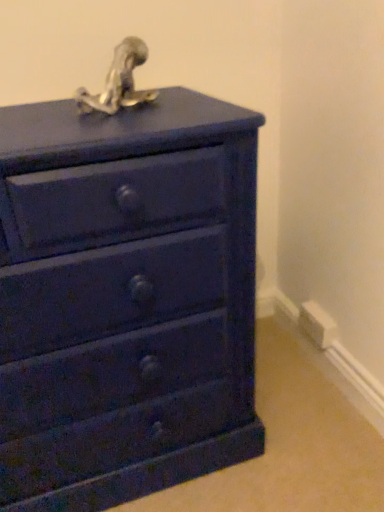
Question: In the image, is white plastic electric outlet at lower right on the left side or the right side of matte blue chest of drawers at center?

Choices:
 (A) right
 (B) left

Answer: (A)

Question: Is white plastic electric outlet at lower right situated inside matte blue chest of drawers at center or outside?

Choices:
 (A) outside
 (B) inside

Answer: (A)

Question: Which object is the closest to the matte blue chest of drawers at center?

Choices:
 (A) metallic silver sculpture at top
 (B) white plastic electric outlet at lower right

Answer: (A)

Question: Which object is the closest to the white plastic electric outlet at lower right?

Choices:
 (A) metallic silver sculpture at top
 (B) matte blue chest of drawers at center

Answer: (B)